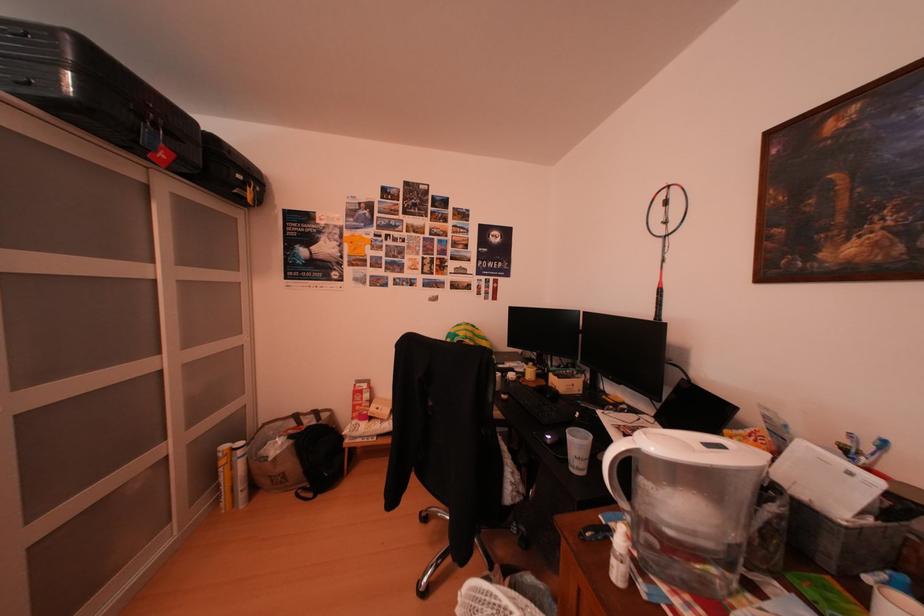
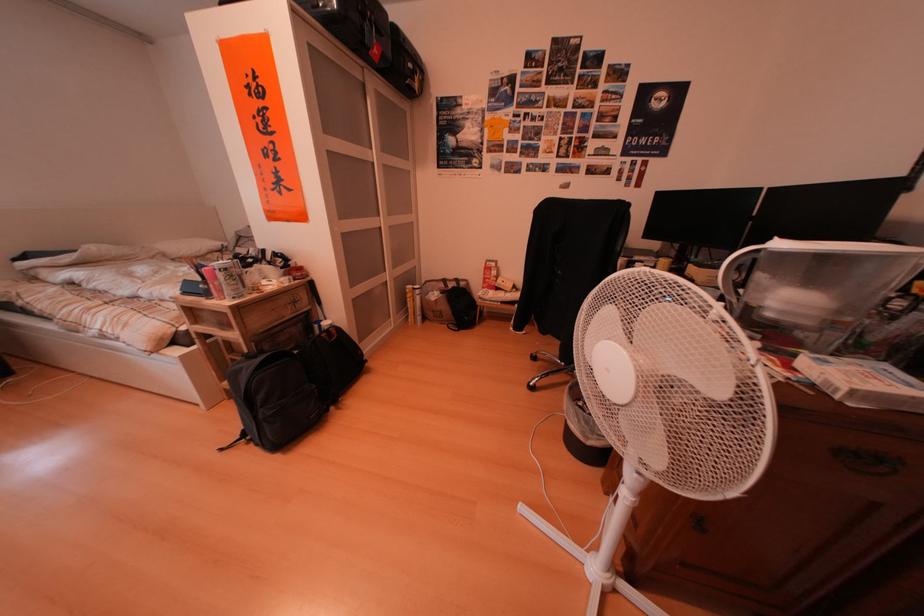
The images are taken continuously from a first-person perspective. In which direction is your viewpoint rotating?

The camera rotated toward left-down.